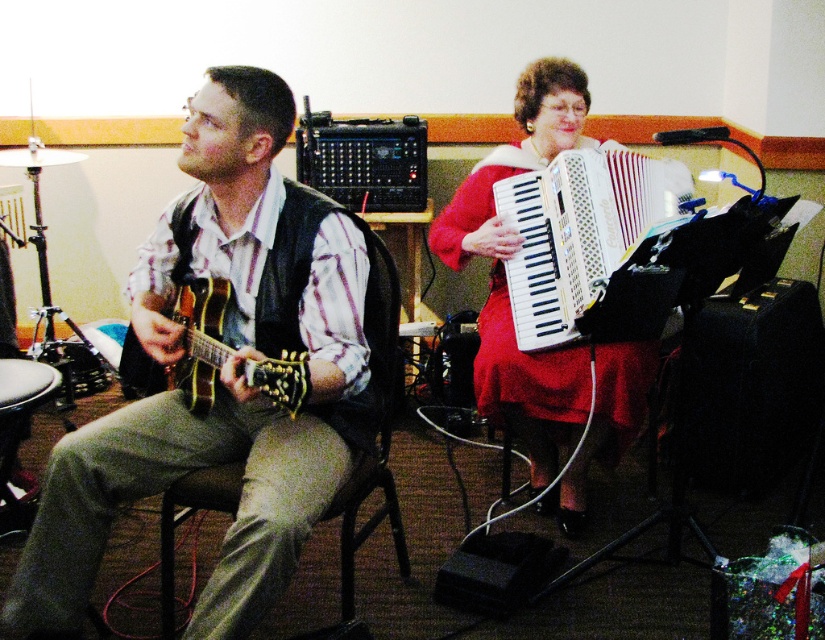
Question: Which point is farther from the camera taking this photo?

Choices:
 (A) (290, 397)
 (B) (248, 588)
 (C) (552, 288)
 (D) (182, 484)

Answer: (C)

Question: Can you confirm if matte black guitar at left is smaller than red satin dress at center?

Choices:
 (A) yes
 (B) no

Answer: (A)

Question: Can you confirm if white plastic accordion at center is positioned above brown wooden chair at left?

Choices:
 (A) no
 (B) yes

Answer: (B)

Question: Among these points, which one is farthest from the camera?

Choices:
 (A) (186, 470)
 (B) (596, 385)
 (C) (199, 308)

Answer: (B)

Question: Which of the following is the farthest from the observer?

Choices:
 (A) matte black guitar at left
 (B) matte wood guitar at left
 (C) brown wooden chair at left

Answer: (C)

Question: Is matte black guitar at left to the right of white plastic accordion at center from the viewer's perspective?

Choices:
 (A) yes
 (B) no

Answer: (B)